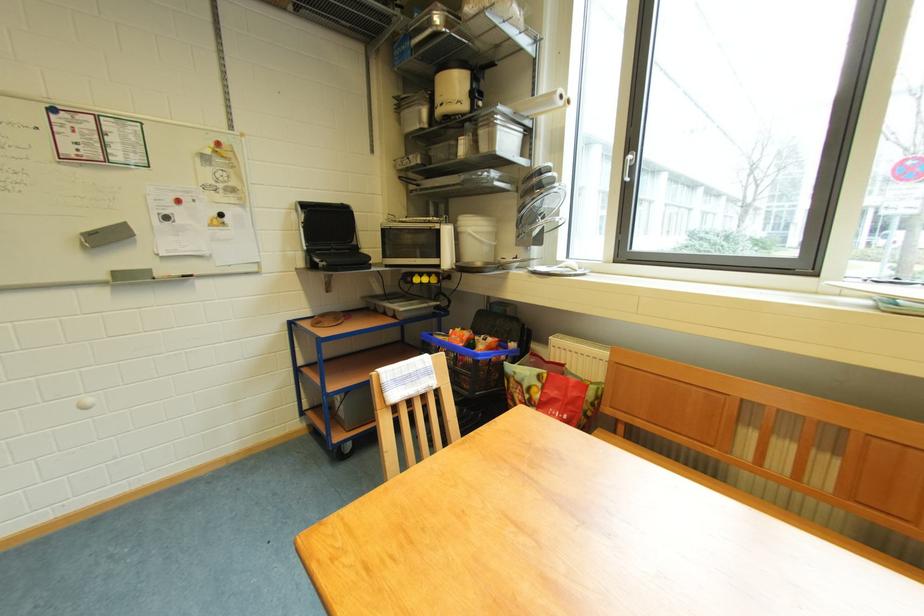
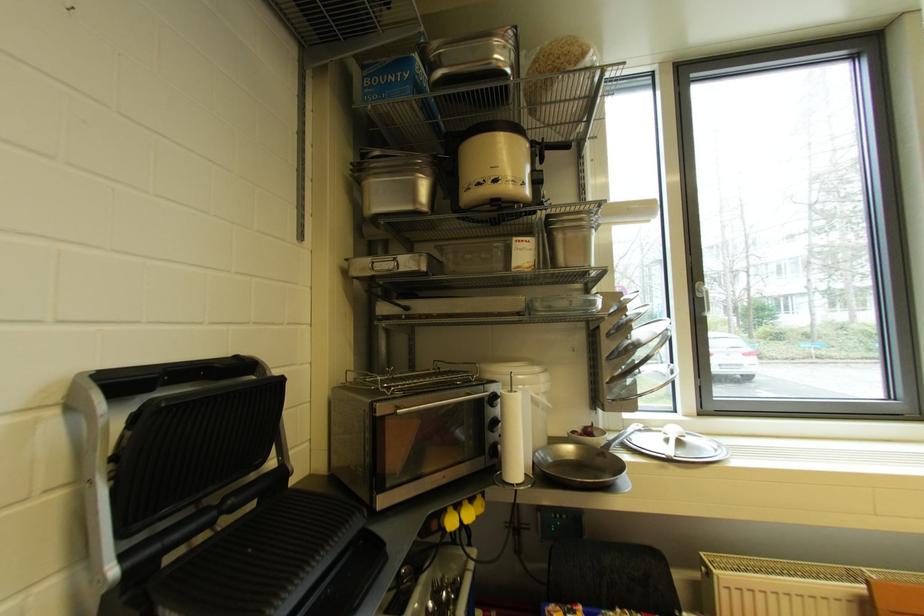
The point at (426, 130) is marked in the first image. Where is the corresponding point in the second image?

(418, 211)